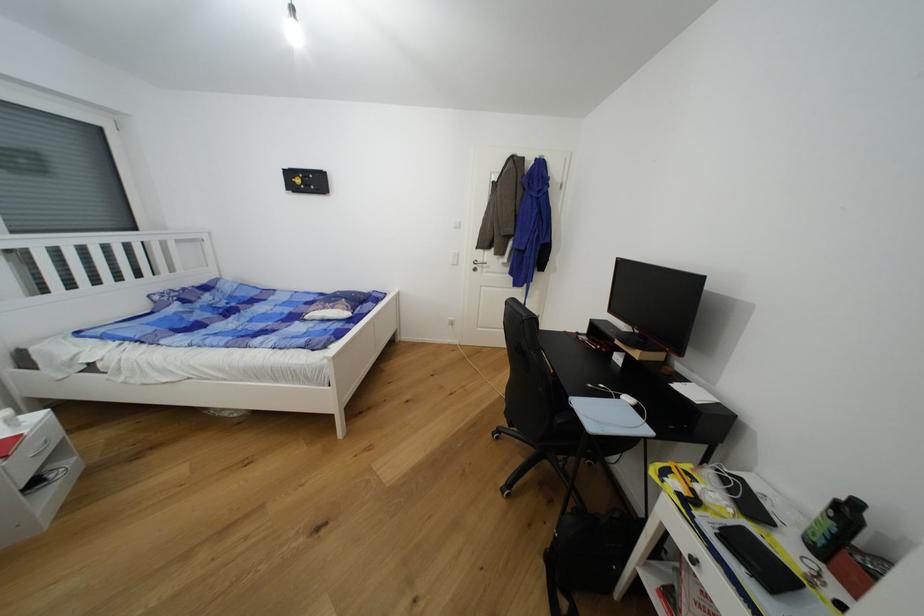
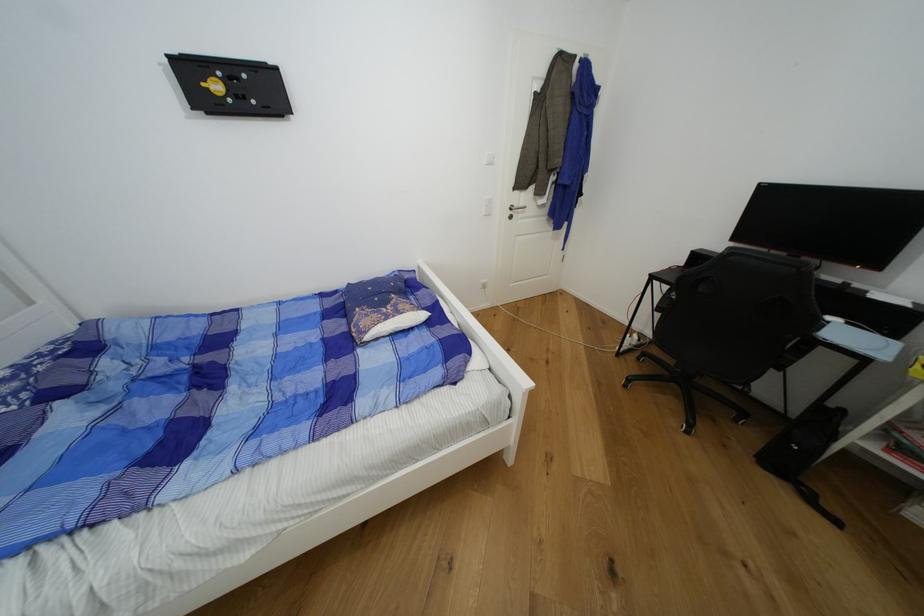
In the second image, find the point that corresponds to point (484, 262) in the first image.

(521, 207)